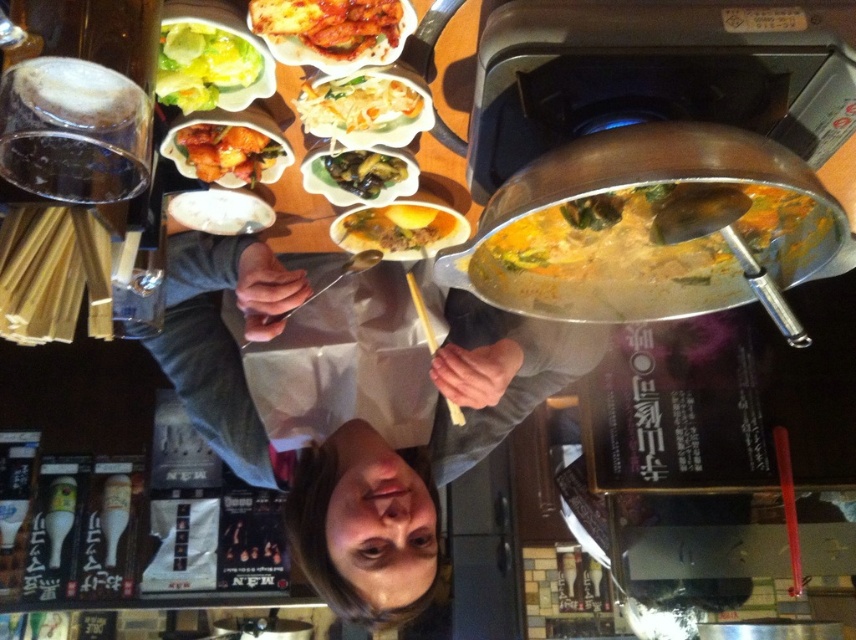
Question: Does smooth gray sweater at center appear under glazed glossy chicken at upper center?

Choices:
 (A) yes
 (B) no

Answer: (A)

Question: Which of these objects is positioned farthest from the golden crispy chicken at center?

Choices:
 (A) green leafy lettuce at upper left
 (B) yellow creamy soup at center

Answer: (B)

Question: In this image, where is green leafy lettuce at upper left located relative to green glossy vegetables at center?

Choices:
 (A) below
 (B) above

Answer: (B)

Question: Can you confirm if smooth gray sweater at center is thinner than green leafy lettuce at upper left?

Choices:
 (A) yes
 (B) no

Answer: (B)

Question: Which object is the farthest from the smooth gray sweater at center?

Choices:
 (A) yellow wood chopstick at center
 (B) glazed glossy chicken at upper center

Answer: (B)

Question: Which point is farther to the camera?

Choices:
 (A) (563, 301)
 (B) (233, 68)

Answer: (A)